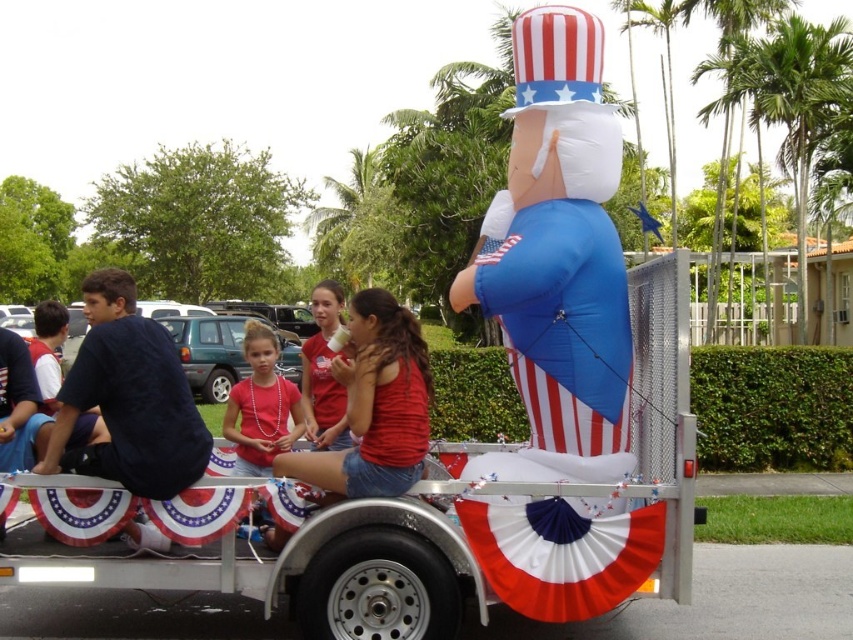
Does point (340, 502) come closer to viewer compared to point (262, 460)?

Yes, point (340, 502) is in front of point (262, 460).

This screenshot has width=853, height=640. What do you see at coordinates (381, 513) in the screenshot? I see `inflatable uncle sam at center` at bounding box center [381, 513].

Locate an element on the screen. The image size is (853, 640). inflatable uncle sam at center is located at coordinates (381, 513).

Is red white and blue fabric at center shorter than matte red shirt at center?

Yes.

Is red white and blue fabric at center to the right of matte red shirt at center from the viewer's perspective?

Indeed, red white and blue fabric at center is positioned on the right side of matte red shirt at center.

At what (x,y) coordinates should I click in order to perform the action: click on red white and blue fabric at center. Please return your answer as a coordinate pair (x, y). Image resolution: width=853 pixels, height=640 pixels. Looking at the image, I should click on (561, 552).

This screenshot has width=853, height=640. In order to click on red white and blue fabric at center in this screenshot , I will do `click(561, 552)`.

Who is shorter, dark blue fabric shirt at left or matte red shirt at center?

matte red shirt at center

Between point (100, 456) and point (253, 410), which one is positioned in front?

Point (100, 456) is in front.

Find the location of a particular element. The image size is (853, 640). dark blue fabric shirt at left is located at coordinates (128, 397).